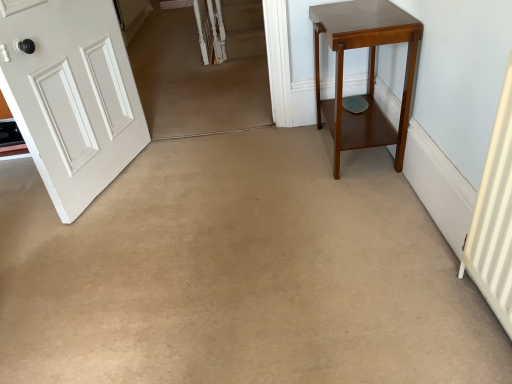
This screenshot has width=512, height=384. Identify the location of white painted wood door at left. (71, 95).

Image resolution: width=512 pixels, height=384 pixels. What do you see at coordinates (71, 95) in the screenshot? I see `white painted wood door at left` at bounding box center [71, 95].

Measure the distance between point (333, 104) and camera.

The distance of point (333, 104) from camera is 8.06 feet.

Measure the distance between mahogany wood side table at right and camera.

mahogany wood side table at right and camera are 5.48 feet apart.

Identify the location of mahogany wood side table at right. The height and width of the screenshot is (384, 512). [368, 71].

What do you see at coordinates (368, 71) in the screenshot? I see `mahogany wood side table at right` at bounding box center [368, 71].

I want to click on white painted wood door at left, so click(x=71, y=95).

Can you confirm if white painted wood door at left is positioned to the right of mahogany wood side table at right?

In fact, white painted wood door at left is to the left of mahogany wood side table at right.

Is white painted wood door at left in front of or behind mahogany wood side table at right in the image?

white painted wood door at left is positioned closer to the viewer than mahogany wood side table at right.

Which is less distant, [50,83] or [358,21]?

Point [50,83].

Consider the image. From the image's perspective, between white painted wood door at left and mahogany wood side table at right, which one is located above?

mahogany wood side table at right, from the image's perspective.

From a real-world perspective, is white painted wood door at left physically below mahogany wood side table at right?

Incorrect, from a real-world perspective, white painted wood door at left is higher than mahogany wood side table at right.

Which object is wider, white painted wood door at left or mahogany wood side table at right?

Wider between the two is mahogany wood side table at right.

In the scene shown: From their relative heights in the image, would you say white painted wood door at left is taller or shorter than mahogany wood side table at right?

white painted wood door at left is taller than mahogany wood side table at right.

Based on the photo, between white painted wood door at left and mahogany wood side table at right, which one has smaller size?

white painted wood door at left is smaller.

Do you think white painted wood door at left is within mahogany wood side table at right, or outside of it?

white painted wood door at left is outside mahogany wood side table at right.

Are white painted wood door at left and mahogany wood side table at right far apart?

white painted wood door at left is far away from mahogany wood side table at right.

Is white painted wood door at left oriented towards mahogany wood side table at right?

Yes, white painted wood door at left is oriented towards mahogany wood side table at right.

Measure the distance from white painted wood door at left to mahogany wood side table at right.

They are 1.17 meters apart.

Find the location of a particular element. The width and height of the screenshot is (512, 384). door in front of the mahogany wood side table at right is located at coordinates tap(71, 95).

Based on their positions, is mahogany wood side table at right located to the left or right of white painted wood door at left?

mahogany wood side table at right is to the right of white painted wood door at left.

Is mahogany wood side table at right further to the viewer compared to white painted wood door at left?

Yes, it is.

Does point (397, 132) come in front of point (102, 108)?

Yes, point (397, 132) is in front of point (102, 108).

From the image's perspective, is mahogany wood side table at right located above white painted wood door at left?

Indeed, from the image's perspective, mahogany wood side table at right is shown above white painted wood door at left.

From a real-world perspective, is mahogany wood side table at right above or below white painted wood door at left?

mahogany wood side table at right is situated lower than white painted wood door at left in the real world.

Which of these two, mahogany wood side table at right or white painted wood door at left, is wider?

mahogany wood side table at right.

Considering the relative sizes of mahogany wood side table at right and white painted wood door at left in the image provided, is mahogany wood side table at right taller than white painted wood door at left?

No, mahogany wood side table at right is not taller than white painted wood door at left.

Between mahogany wood side table at right and white painted wood door at left, which one has larger size?

With larger size is mahogany wood side table at right.

Is mahogany wood side table at right completely or partially outside of white painted wood door at left?

Yes.

Is mahogany wood side table at right with white painted wood door at left?

No, mahogany wood side table at right is not with white painted wood door at left.

Could you tell me if mahogany wood side table at right is facing white painted wood door at left?

Yes, mahogany wood side table at right is aimed at white painted wood door at left.

How distant is mahogany wood side table at right from white painted wood door at left?

They are 1.17 meters apart.

Find the location of a particular element. The width and height of the screenshot is (512, 384). table behind the white painted wood door at left is located at coordinates (368, 71).

Image resolution: width=512 pixels, height=384 pixels. I want to click on table that is behind the white painted wood door at left, so click(x=368, y=71).

Where is `table on the right of white painted wood door at left`? The image size is (512, 384). table on the right of white painted wood door at left is located at coordinates 368,71.